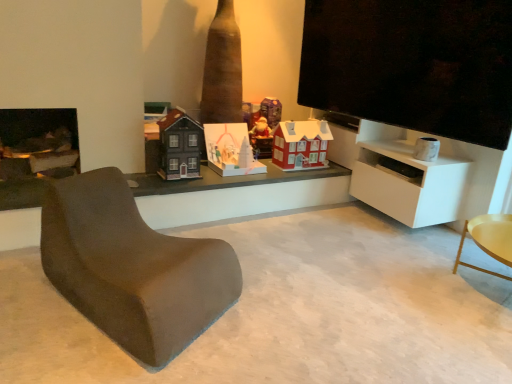
Question: From the image's perspective, is matte white paper house at center, acting as the second toy starting from the left, located beneath matte red house at center, placed as the third toy when sorted from left to right?

Choices:
 (A) yes
 (B) no

Answer: (A)

Question: Is matte white paper house at center, acting as the second toy starting from the left, far from matte red house at center, placed as the third toy when sorted from left to right?

Choices:
 (A) no
 (B) yes

Answer: (A)

Question: Considering the relative positions of matte white paper house at center, acting as the second toy starting from the left, and matte red house at center, the 2th toy in the right-to-left sequence, in the image provided, is matte white paper house at center, acting as the second toy starting from the left, behind matte red house at center, the 2th toy in the right-to-left sequence,?

Choices:
 (A) yes
 (B) no

Answer: (B)

Question: Does matte white paper house at center, acting as the 3th toy starting from the right, have a lesser height compared to matte red house at center, the 2th toy in the right-to-left sequence?

Choices:
 (A) no
 (B) yes

Answer: (B)

Question: Does matte white paper house at center, acting as the 3th toy starting from the right, have a greater width compared to matte red house at center, placed as the third toy when sorted from left to right?

Choices:
 (A) no
 (B) yes

Answer: (B)

Question: In terms of height, does matte black house at center, positioned as the 4th toy in right-to-left order, look taller or shorter compared to matte white paper house at center, acting as the second toy starting from the left?

Choices:
 (A) short
 (B) tall

Answer: (B)

Question: Considering the positions of point (170, 157) and point (207, 152), is point (170, 157) closer or farther from the camera than point (207, 152)?

Choices:
 (A) farther
 (B) closer

Answer: (B)

Question: From the image's perspective, is matte black house at center, marked as the first toy in a left-to-right arrangement, located above or below matte white paper house at center, acting as the second toy starting from the left?

Choices:
 (A) below
 (B) above

Answer: (B)

Question: From a real-world perspective, relative to matte white paper house at center, acting as the second toy starting from the left, is matte black house at center, positioned as the 4th toy in right-to-left order, vertically above or below?

Choices:
 (A) above
 (B) below

Answer: (A)

Question: Looking at their shapes, would you say white matte cabinet at right is wider or thinner than matte red house at center, placed as the third toy when sorted from left to right?

Choices:
 (A) wide
 (B) thin

Answer: (A)

Question: In the image, is white matte cabinet at right on the left side or the right side of matte red house at center, placed as the third toy when sorted from left to right?

Choices:
 (A) left
 (B) right

Answer: (B)

Question: Is white matte cabinet at right in front of or behind matte red house at center, the 2th toy in the right-to-left sequence, in the image?

Choices:
 (A) front
 (B) behind

Answer: (A)

Question: Looking at the image, does white matte cabinet at right seem bigger or smaller compared to matte red house at center, placed as the third toy when sorted from left to right?

Choices:
 (A) big
 (B) small

Answer: (A)

Question: Considering the positions of point (391, 190) and point (225, 168), is point (391, 190) closer or farther from the camera than point (225, 168)?

Choices:
 (A) closer
 (B) farther

Answer: (A)

Question: Is white matte cabinet at right bigger or smaller than matte white paper house at center, acting as the second toy starting from the left?

Choices:
 (A) small
 (B) big

Answer: (B)